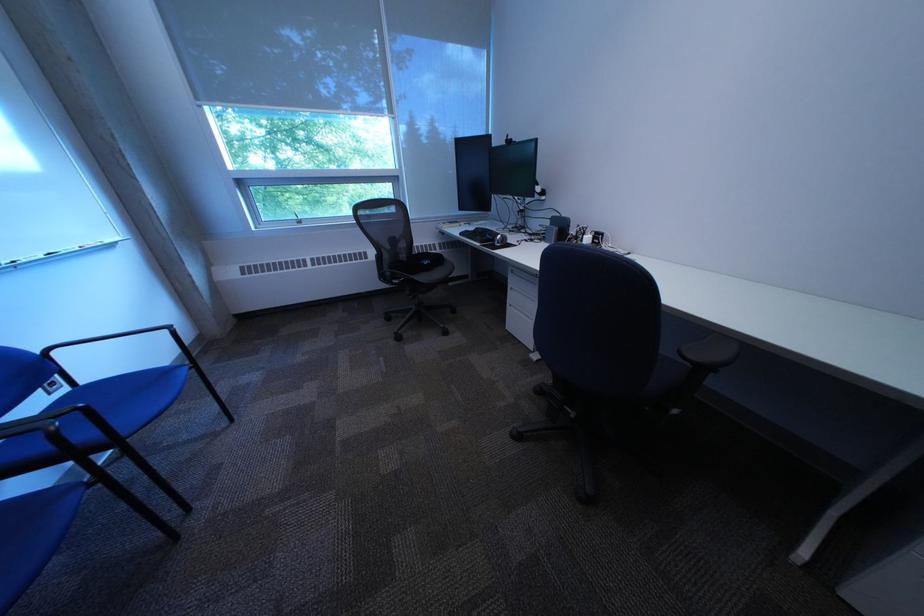
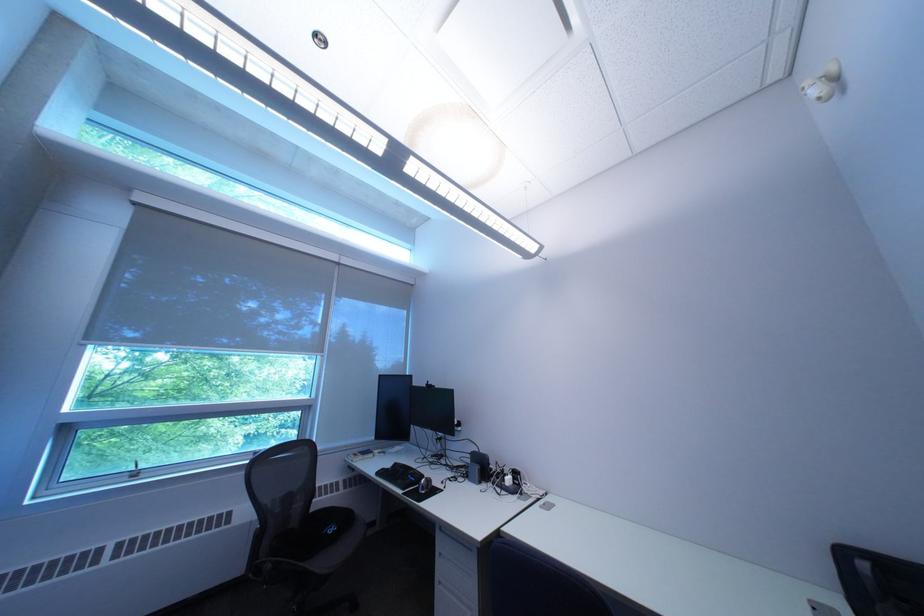
The first image is from the beginning of the video and the second image is from the end. How did the camera likely rotate when shooting the video?

The camera's rotation is toward right-up.